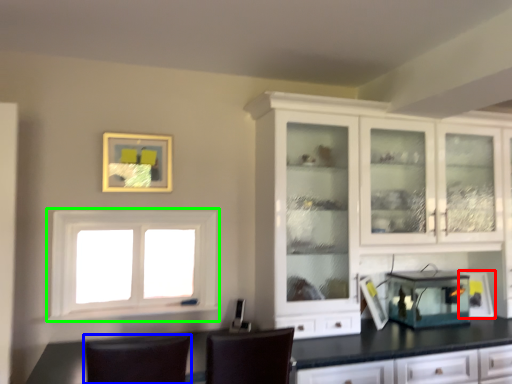
Question: Considering the real-world distances, which object is closest to appliance (highlighted by a red box)? chair (highlighted by a blue box) or window (highlighted by a green box).

Choices:
 (A) chair
 (B) window

Answer: (A)